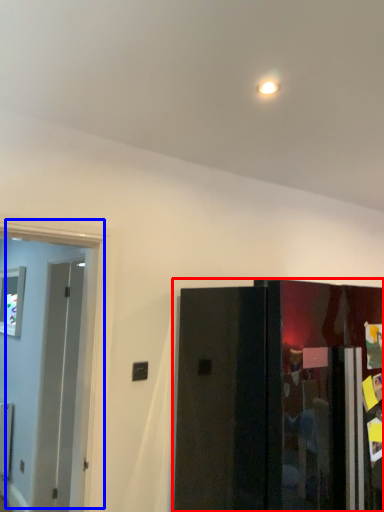
Question: Which point is closer to the camera, door (highlighted by a red box) or door (highlighted by a blue box)?

Choices:
 (A) door
 (B) door

Answer: (A)